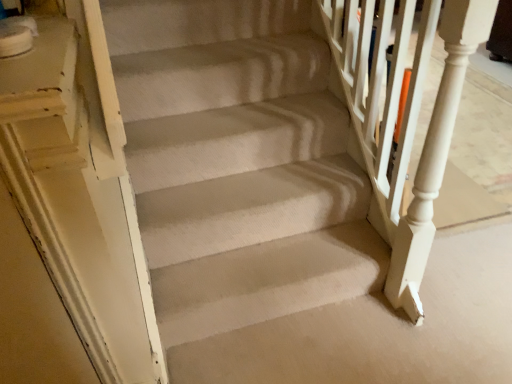
Question: Considering their positions, is beige carpeted stairs at center located in front of or behind white textured rail at upper right?

Choices:
 (A) front
 (B) behind

Answer: (B)

Question: In terms of width, does beige carpeted stairs at center look wider or thinner when compared to white textured rail at upper right?

Choices:
 (A) wide
 (B) thin

Answer: (A)

Question: Does point (444, 360) appear closer or farther from the camera than point (385, 160)?

Choices:
 (A) farther
 (B) closer

Answer: (B)

Question: In terms of width, does white textured rail at upper right look wider or thinner when compared to beige carpeted stairs at center?

Choices:
 (A) wide
 (B) thin

Answer: (B)

Question: Would you say white textured rail at upper right is to the left or to the right of beige carpeted stairs at center in the picture?

Choices:
 (A) right
 (B) left

Answer: (A)

Question: In terms of height, does white textured rail at upper right look taller or shorter compared to beige carpeted stairs at center?

Choices:
 (A) tall
 (B) short

Answer: (A)

Question: From the image's perspective, is white textured rail at upper right located above or below beige carpeted stairs at center?

Choices:
 (A) below
 (B) above

Answer: (B)